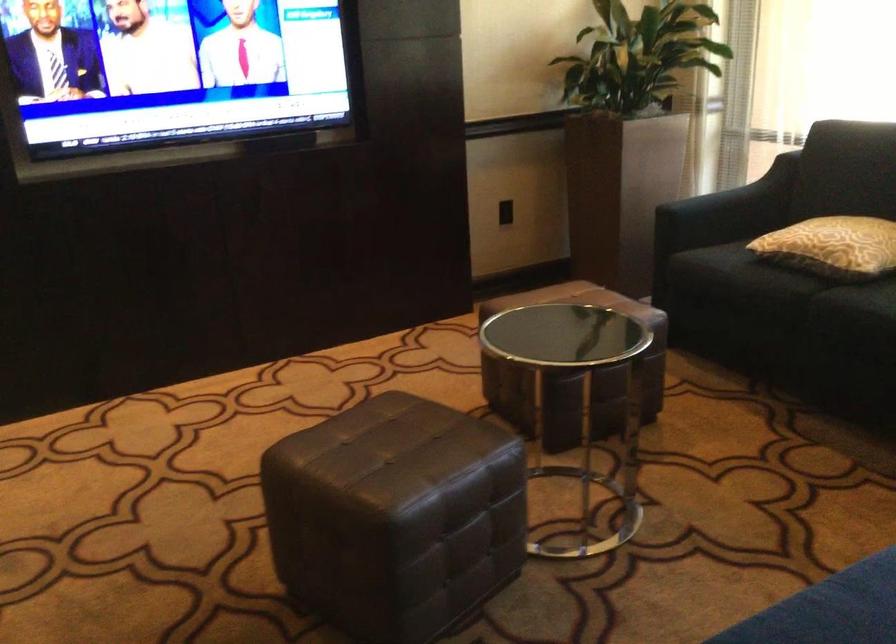
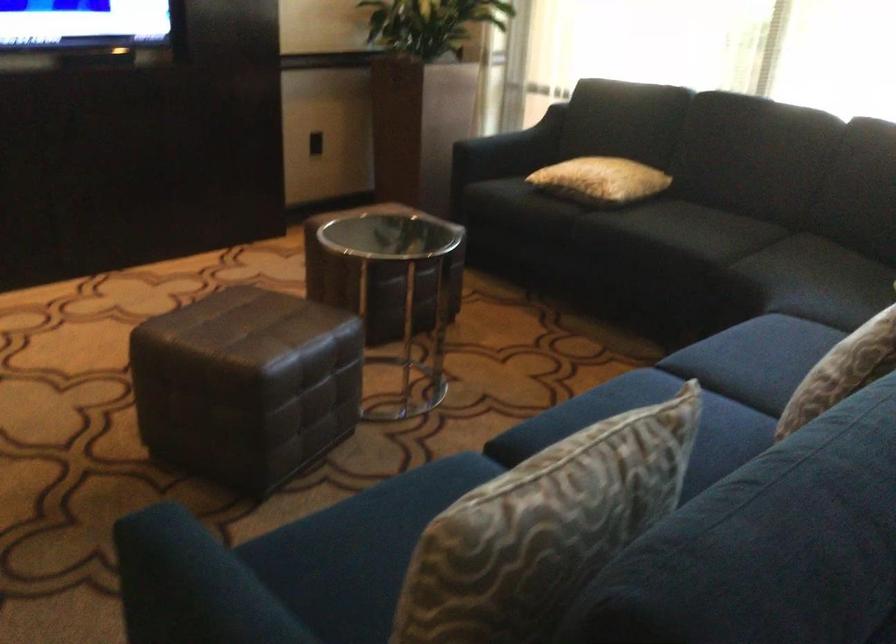
What movement of the cameraman would produce the second image?

The movement direction of the cameraman is left, backward.